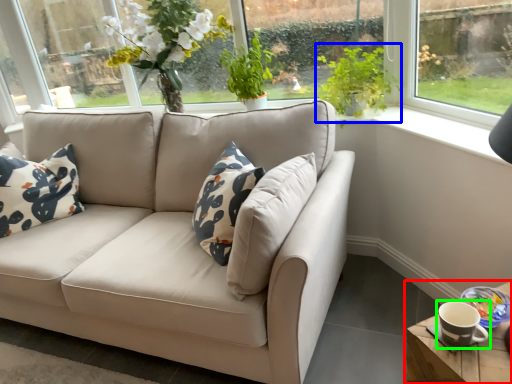
Question: Estimate the real-world distances between objects in this image. Which object is farther from table (highlighted by a red box), plant (highlighted by a blue box) or coffee cup (highlighted by a green box)?

Choices:
 (A) plant
 (B) coffee cup

Answer: (A)